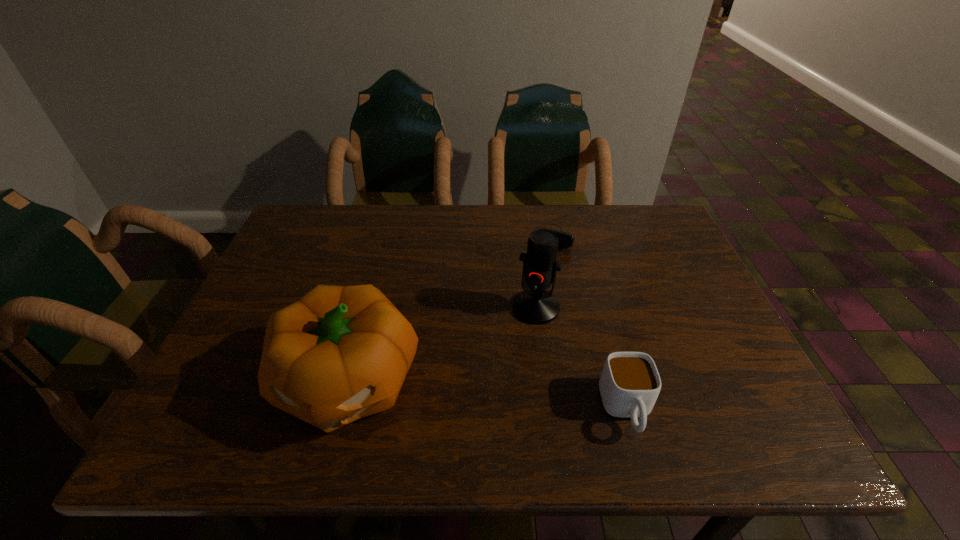
Identify the location of the leftmost object. This screenshot has width=960, height=540. (338, 354).

At what (x,y) coordinates should I click in order to perform the action: click on the third tallest object. Please return your answer as a coordinate pair (x, y). Looking at the image, I should click on click(x=629, y=385).

You are a GUI agent. You are given a task and a screenshot of the screen. Output one action in this format:
    pyautogui.click(x=<x>, y=<y>)
    Task: Click on the third nearest object
    
    Given the screenshot: What is the action you would take?
    pyautogui.click(x=534, y=305)

At what (x,y) coordinates should I click in order to perform the action: click on the shortest object. Please return your answer as a coordinate pair (x, y). Looking at the image, I should click on pos(566,240).

Identify the location of the farthest object. The width and height of the screenshot is (960, 540). (566, 240).

Locate an element on the screen. This screenshot has width=960, height=540. free region located on the side of the second farthest object with the red ring is located at coordinates (519, 341).

Where is `vacant space located on the side of the second farthest object with the red ring`? The height and width of the screenshot is (540, 960). vacant space located on the side of the second farthest object with the red ring is located at coordinates (498, 386).

Where is `vacant area located 0.200m on the side of the second farthest object with the red ring`? vacant area located 0.200m on the side of the second farthest object with the red ring is located at coordinates (496, 390).

You are a GUI agent. You are given a task and a screenshot of the screen. Output one action in this format:
    pyautogui.click(x=<x>, y=<y>)
    Task: Click on the vacant region located 0.250m on the front-facing side of the webcam
    Image resolution: width=960 pixels, height=540 pixels.
    Given the screenshot: What is the action you would take?
    pyautogui.click(x=532, y=309)

This screenshot has height=540, width=960. Identify the location of vacant space located 0.260m on the front-facing side of the webcam. (531, 312).